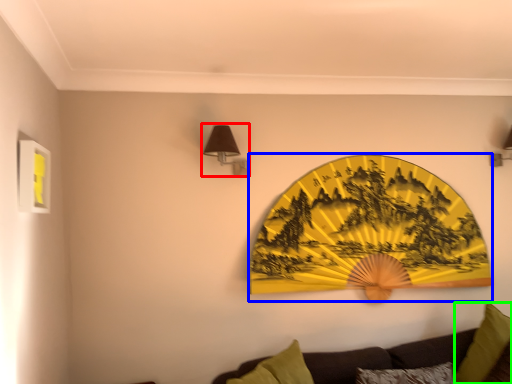
Question: Estimate the real-world distances between objects in this image. Which object is closer to lamp (highlighted by a red box), design (highlighted by a blue box) or pillow (highlighted by a green box)?

Choices:
 (A) design
 (B) pillow

Answer: (A)